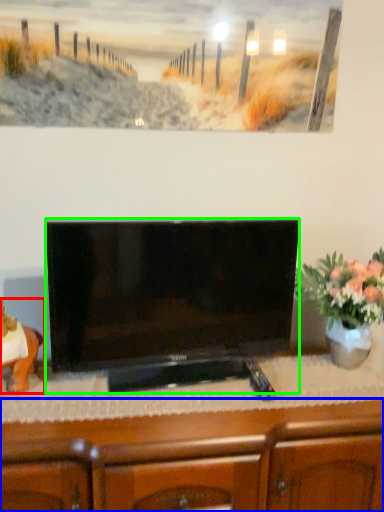
Question: Based on their relative distances, which object is farther from animal (highlighted by a red box)? Choose from cabinetry (highlighted by a blue box) and television (highlighted by a green box).

Choices:
 (A) cabinetry
 (B) television

Answer: (A)